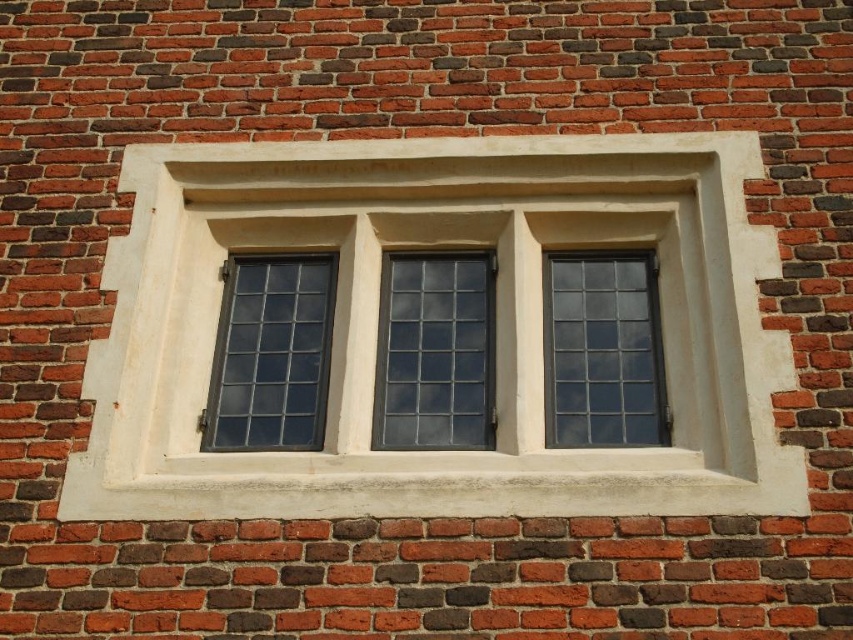
Which is more to the left, white stone window frame at center or clear glass window at center right?

white stone window frame at center

Which is below, white stone window frame at center or clear glass window at center right?

clear glass window at center right

The width and height of the screenshot is (853, 640). Identify the location of white stone window frame at center. (495, 324).

Find the location of a particular element. This screenshot has height=640, width=853. white stone window frame at center is located at coordinates (495, 324).

Does white stone window frame at center have a greater width compared to dark glass window at left?

Yes.

Does white stone window frame at center have a greater height compared to dark glass window at left?

Yes, white stone window frame at center is taller than dark glass window at left.

Does point (126, 388) lie in front of point (287, 312)?

Yes.

This screenshot has width=853, height=640. I want to click on white stone window frame at center, so click(495, 324).

Which is below, clear glass window at center right or dark glass window at left?

dark glass window at left

Measure the distance between clear glass window at center right and camera.

clear glass window at center right is 5.73 meters from camera.

The height and width of the screenshot is (640, 853). Describe the element at coordinates (602, 349) in the screenshot. I see `clear glass window at center right` at that location.

Identify the location of clear glass window at center right. (602, 349).